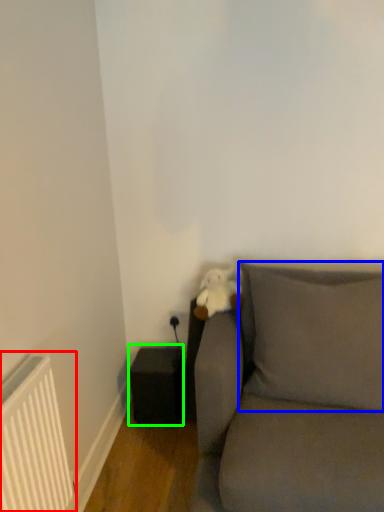
Question: Considering the real-world distances, which object is farthest from radiator (highlighted by a red box)? pillow (highlighted by a blue box) or speaker (highlighted by a green box)?

Choices:
 (A) pillow
 (B) speaker

Answer: (A)